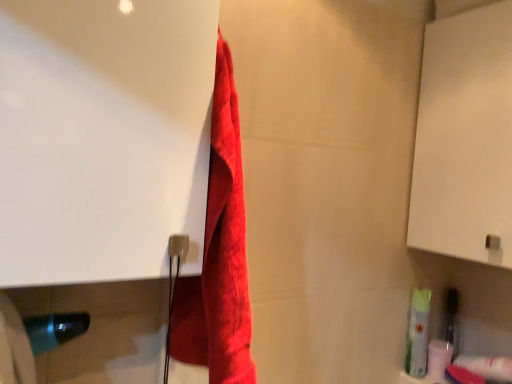
Question: Considering the relative positions of red fluffy towel at center and white matte toilet paper at lower right, which is the second toilet paper in back-to-front order, in the image provided, is red fluffy towel at center to the left of white matte toilet paper at lower right, which is the second toilet paper in back-to-front order, from the viewer's perspective?

Choices:
 (A) no
 (B) yes

Answer: (B)

Question: Does red fluffy towel at center turn towards white matte toilet paper at lower right, which is the second toilet paper in back-to-front order?

Choices:
 (A) yes
 (B) no

Answer: (B)

Question: Does red fluffy towel at center appear on the right side of white matte toilet paper at lower right, marked as the 1th toilet paper in a front-to-back arrangement?

Choices:
 (A) yes
 (B) no

Answer: (B)

Question: Does red fluffy towel at center come in front of white matte toilet paper at lower right, which is the second toilet paper in back-to-front order?

Choices:
 (A) yes
 (B) no

Answer: (A)

Question: From the image's perspective, is red fluffy towel at center on top of white matte toilet paper at lower right, which is the second toilet paper in back-to-front order?

Choices:
 (A) yes
 (B) no

Answer: (A)

Question: Does red fluffy towel at center have a smaller size compared to white matte toilet paper at lower right, marked as the 1th toilet paper in a front-to-back arrangement?

Choices:
 (A) no
 (B) yes

Answer: (A)

Question: Is white glossy screen door at upper left, which ranks as the first screen door in front-to-back order, looking in the opposite direction of white matte cabinet at upper right, which appears as the first screen door when viewed from the back?

Choices:
 (A) yes
 (B) no

Answer: (B)

Question: From the image's perspective, is white glossy screen door at upper left, the second screen door in the right-to-left sequence, located above white matte cabinet at upper right, the first screen door from the right?

Choices:
 (A) no
 (B) yes

Answer: (A)

Question: Does white glossy screen door at upper left, which is counted as the 1th screen door, starting from the left, have a greater height compared to white matte cabinet at upper right, which is the 2th screen door from front to back?

Choices:
 (A) no
 (B) yes

Answer: (A)

Question: Would you say white glossy screen door at upper left, which ranks as the first screen door in front-to-back order, is a long distance from white matte cabinet at upper right, which appears as the first screen door when viewed from the back?

Choices:
 (A) yes
 (B) no

Answer: (B)

Question: Is white glossy screen door at upper left, the second screen door in the right-to-left sequence, at the right side of white matte cabinet at upper right, the 2th screen door positioned from the left?

Choices:
 (A) yes
 (B) no

Answer: (B)

Question: Could you tell me if white glossy screen door at upper left, arranged as the second screen door when viewed from the back, is facing white matte cabinet at upper right, which is the 2th screen door from front to back?

Choices:
 (A) no
 (B) yes

Answer: (A)

Question: Is white glossy screen door at upper left, the second screen door in the right-to-left sequence, aimed at white matte toilet paper at lower right, the 2th toilet paper viewed from the front?

Choices:
 (A) no
 (B) yes

Answer: (A)